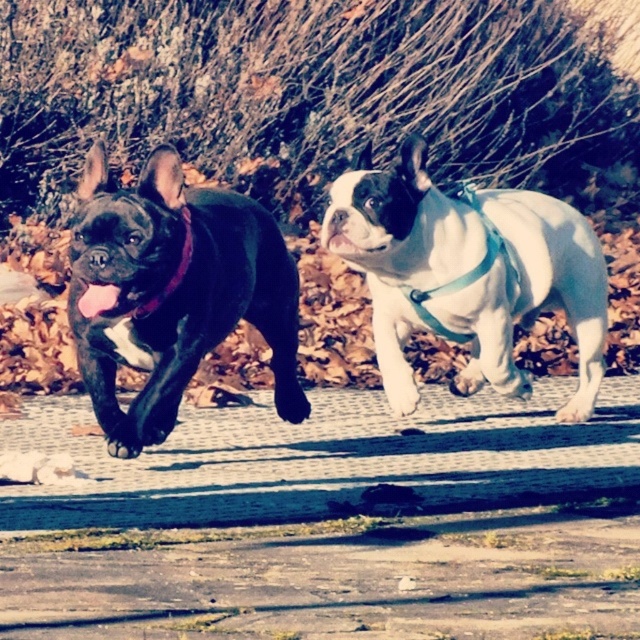
Question: Does shiny black dog at left lie behind pink matte tongue at center?

Choices:
 (A) yes
 (B) no

Answer: (A)

Question: Which object is the farthest from the shiny black dog at left?

Choices:
 (A) pink matte tongue at center
 (B) white matte french bulldog at center

Answer: (B)

Question: Which of the following is the farthest from the observer?

Choices:
 (A) (284, 419)
 (B) (100, 292)
 (C) (564, 410)
 (D) (180, 211)

Answer: (C)

Question: Does white matte french bulldog at center appear over pink matte tongue at center?

Choices:
 (A) yes
 (B) no

Answer: (A)

Question: Among these points, which one is farthest from the camera?

Choices:
 (A) (168, 428)
 (B) (93, 312)
 (C) (177, 275)
 (D) (396, 218)

Answer: (A)

Question: Can you confirm if white matte french bulldog at center is positioned to the left of purple fabric neckband at left?

Choices:
 (A) no
 (B) yes

Answer: (A)